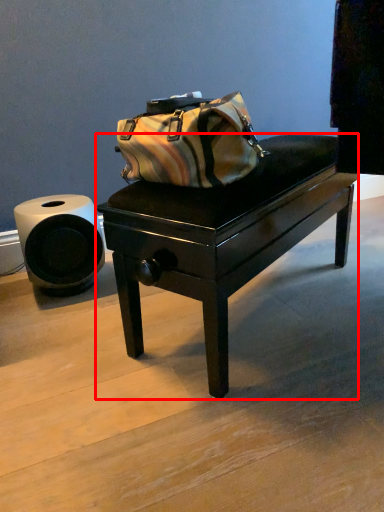
Question: Where is table (annotated by the red box) located in relation to toilet paper in the image?

Choices:
 (A) left
 (B) right

Answer: (B)